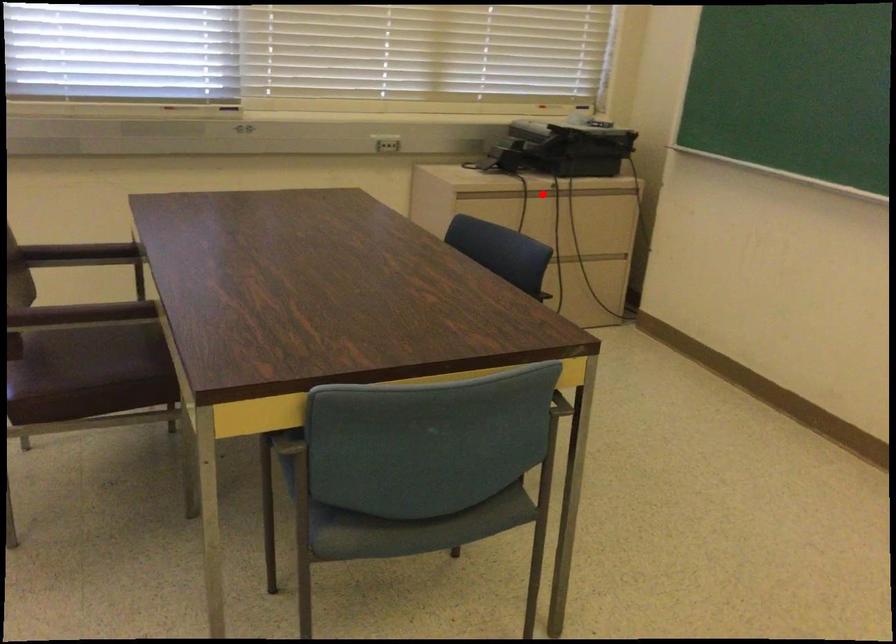
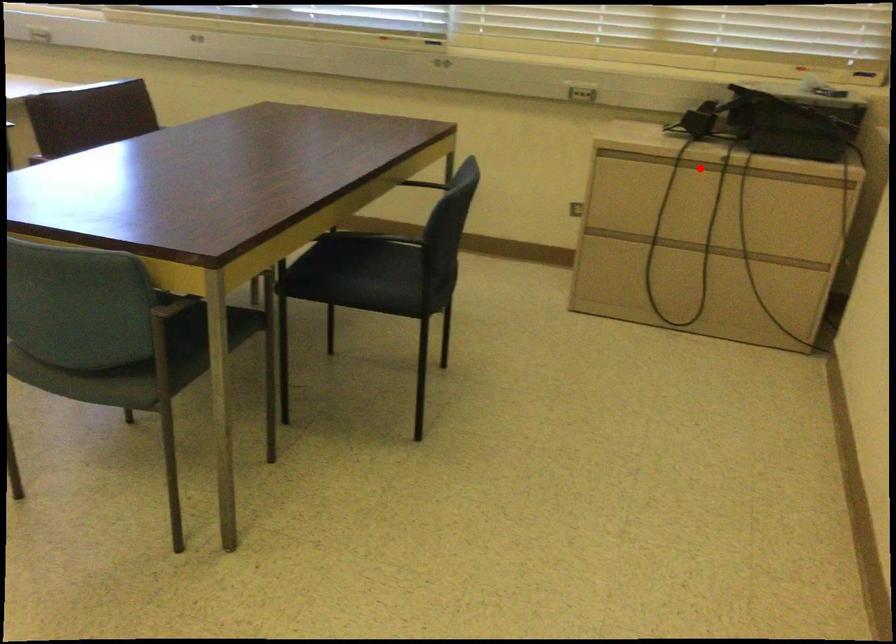
I am providing you with two images of the same scene from different viewpoints. A red point is marked on the first image and another point is marked on the second image. Do the highlighted points in image1 and image2 indicate the same real-world spot?

Yes